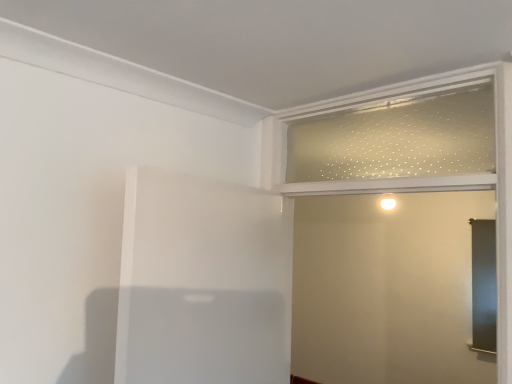
Question: From the image's perspective, would you say clear frosted glass screen door at upper right is shown under clear glass window frame at upper right?

Choices:
 (A) yes
 (B) no

Answer: (A)

Question: Does clear frosted glass screen door at upper right have a smaller size compared to clear glass window frame at upper right?

Choices:
 (A) no
 (B) yes

Answer: (A)

Question: Considering the relative sizes of clear frosted glass screen door at upper right and clear glass window frame at upper right in the image provided, is clear frosted glass screen door at upper right shorter than clear glass window frame at upper right?

Choices:
 (A) no
 (B) yes

Answer: (A)

Question: Is clear frosted glass screen door at upper right oriented away from clear glass window frame at upper right?

Choices:
 (A) no
 (B) yes

Answer: (B)

Question: Can clear glass window frame at upper right be found inside clear frosted glass screen door at upper right?

Choices:
 (A) no
 (B) yes

Answer: (B)

Question: Is clear frosted glass screen door at upper right not within clear glass window frame at upper right?

Choices:
 (A) yes
 (B) no

Answer: (A)

Question: Is clear glass window frame at upper right turned away from white matte elevator at center?

Choices:
 (A) yes
 (B) no

Answer: (B)

Question: Does clear glass window frame at upper right have a larger size compared to white matte elevator at center?

Choices:
 (A) yes
 (B) no

Answer: (B)

Question: Would you say white matte elevator at center is part of clear glass window frame at upper right's contents?

Choices:
 (A) no
 (B) yes

Answer: (A)

Question: Could you tell me if clear glass window frame at upper right is turned towards white matte elevator at center?

Choices:
 (A) no
 (B) yes

Answer: (A)

Question: Can you confirm if clear glass window frame at upper right is wider than white matte elevator at center?

Choices:
 (A) no
 (B) yes

Answer: (A)

Question: Is clear glass window frame at upper right further to the viewer compared to white matte elevator at center?

Choices:
 (A) yes
 (B) no

Answer: (A)

Question: Can you confirm if clear frosted glass screen door at upper right is taller than white matte elevator at center?

Choices:
 (A) no
 (B) yes

Answer: (B)